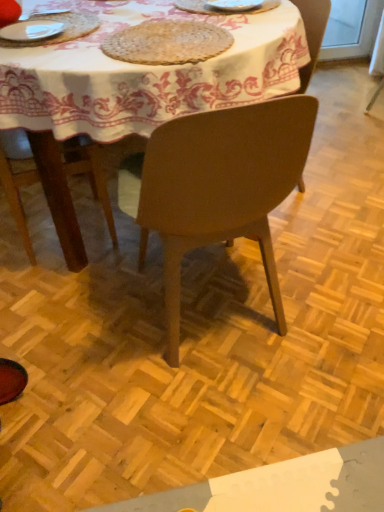
The image size is (384, 512). Find the location of `vacant area that lies between matte brown chair at center, which ranks as the 2th chair in back-to-front order, and white fabric tablecloth at center`. vacant area that lies between matte brown chair at center, which ranks as the 2th chair in back-to-front order, and white fabric tablecloth at center is located at coordinates [x=140, y=319].